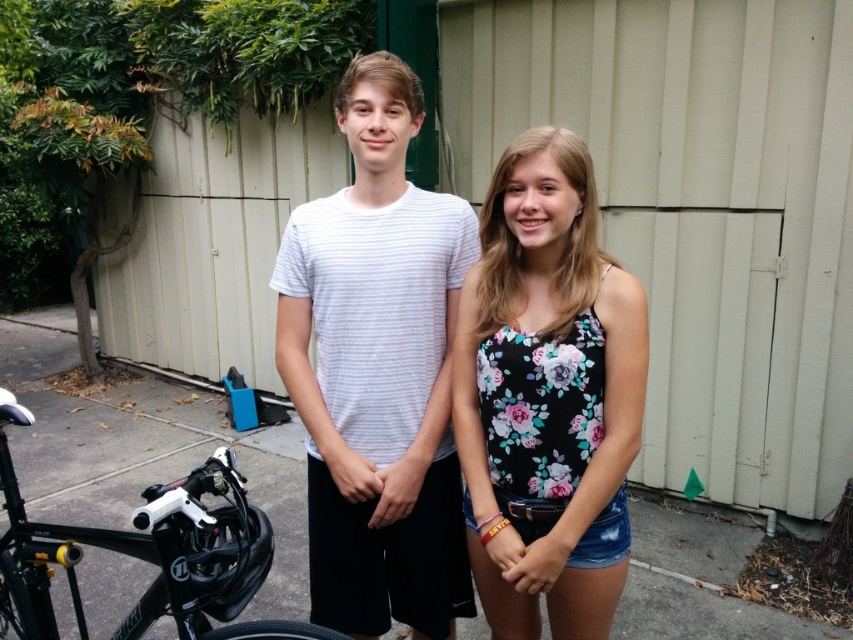
What is the 2D coordinate of the floral print tank top at center?

The 2D coordinate of the floral print tank top at center is at point (547, 396).

You are a photographer setting up for a portrait shoot. You have a camera with a focal length of 50mm. To ensure both the floral print tank top at center and the black matte bicycle at lower left are in focus, what is the minimum distance you should stand from the subjects?

The minimum distance you should stand from the subjects is determined by the hyperfocal distance formula. Given the 50mm focal length and the 26.93 inches separation between the floral print tank top at center and the black matte bicycle at lower left, the hyperfocal distance would need to be calculated to ensure both are in focus. However, without specific aperture and acceptable circle of confusion values, an exact distance can not be provided. A general rule of thumb is to focus approximately one third